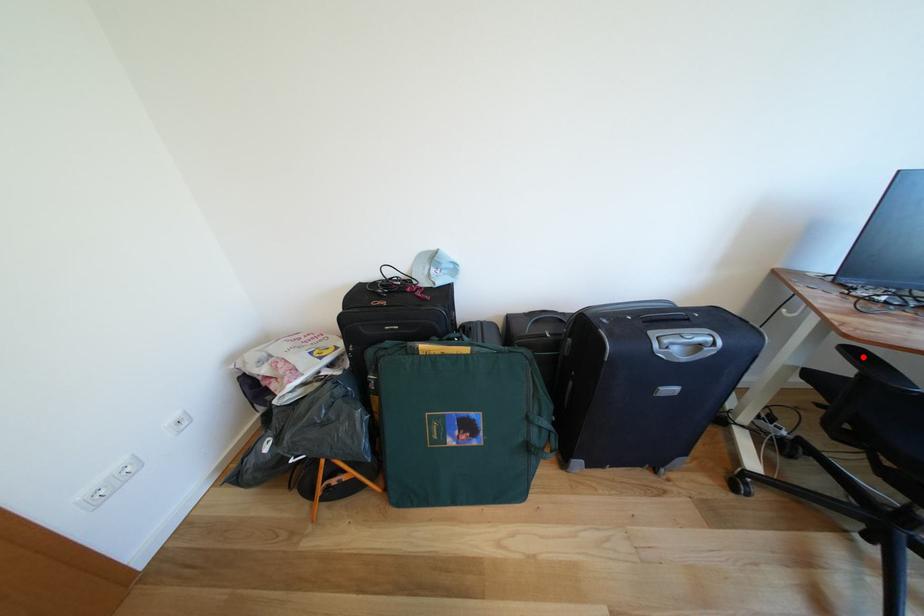
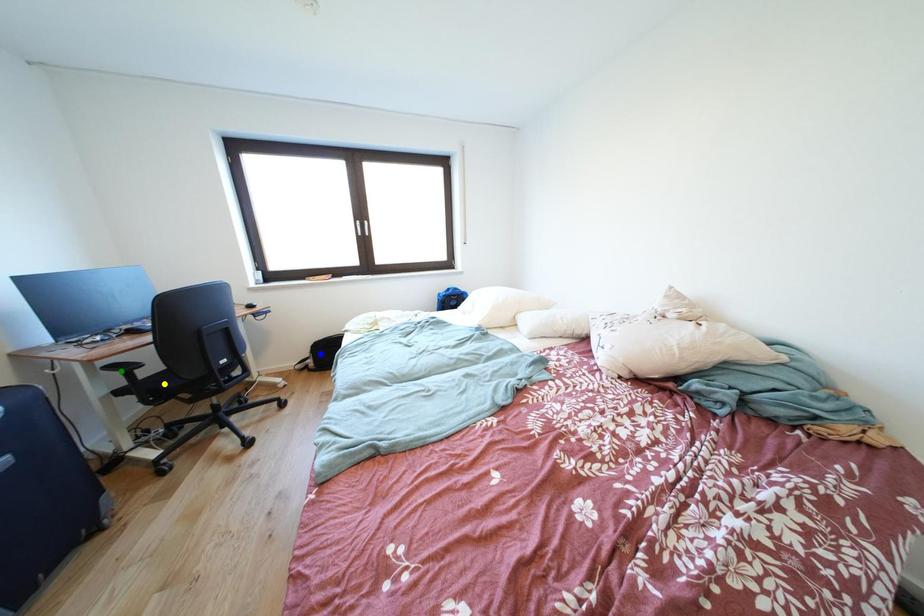
Question: I am providing you with two images of the same scene from different viewpoints. A red point is marked on the first image. You are given multiple points on the second image. Which spot in image 2 lines up with the point in image 1?

Choices:
 (A) yellow point
 (B) blue point
 (C) green point

Answer: (C)